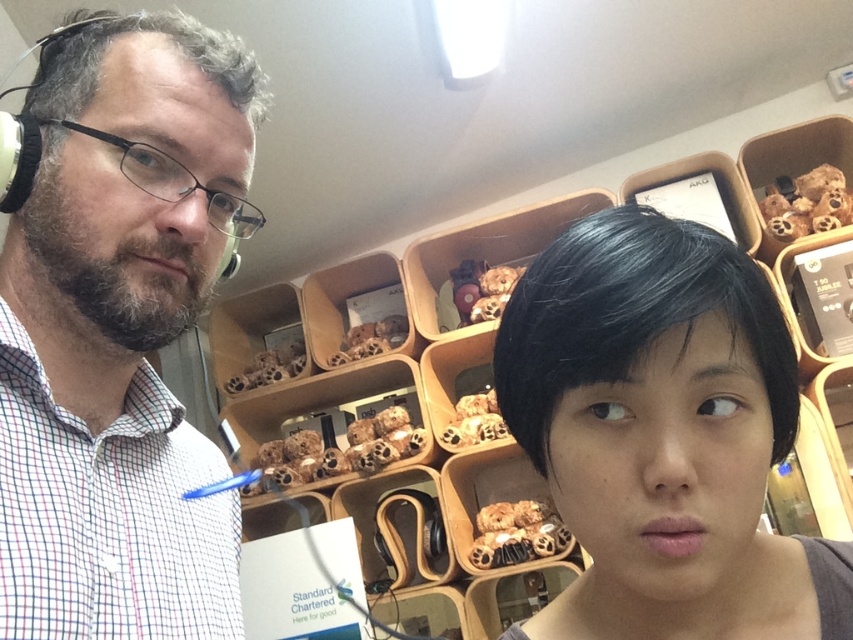
Question: Which object is the closest to the satin black earphone at upper left?

Choices:
 (A) black matte hair at center
 (B) white matte headphones at left

Answer: (B)

Question: Which of the following is the farthest from the observer?

Choices:
 (A) satin black earphone at upper left
 (B) white matte headphones at left

Answer: (A)

Question: Is white matte headphones at left further to camera compared to satin black earphone at upper left?

Choices:
 (A) no
 (B) yes

Answer: (A)

Question: In this image, where is black matte hair at center located relative to satin black earphone at upper left?

Choices:
 (A) above
 (B) below

Answer: (B)

Question: Which object is positioned farthest from the black matte hair at center?

Choices:
 (A) satin black earphone at upper left
 (B) white matte headphones at left

Answer: (A)

Question: Does white matte headphones at left appear over black matte hair at center?

Choices:
 (A) yes
 (B) no

Answer: (A)